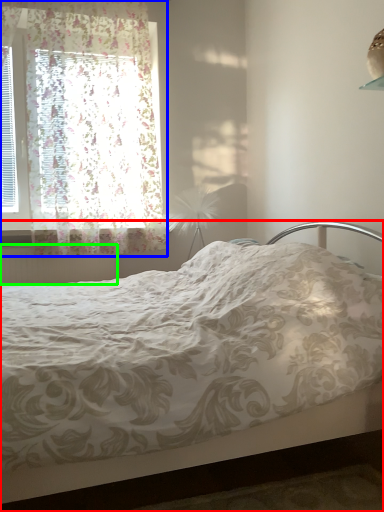
Question: Which is farther away from bed (highlighted by a red box)? window (highlighted by a blue box) or radiator (highlighted by a green box)?

Choices:
 (A) window
 (B) radiator

Answer: (A)